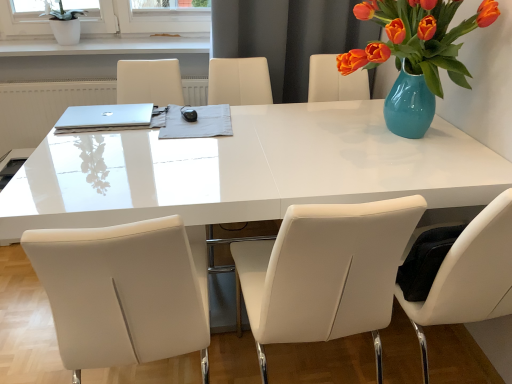
Find the location of a particular element. This screenshot has height=384, width=512. vacant area in front of silver metallic laptop at upper left is located at coordinates (94, 143).